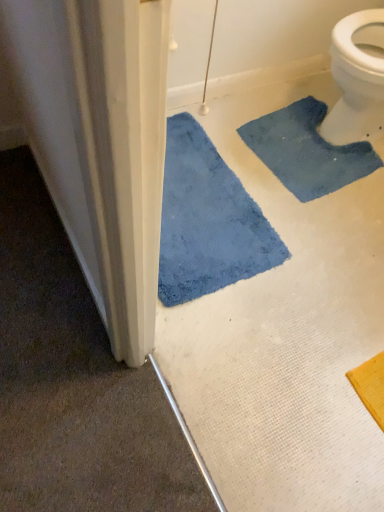
Find the location of `free space in front of blue plush bath mat at lower left, which is counted as the first bath mat, starting from the left`. free space in front of blue plush bath mat at lower left, which is counted as the first bath mat, starting from the left is located at coordinates (245, 379).